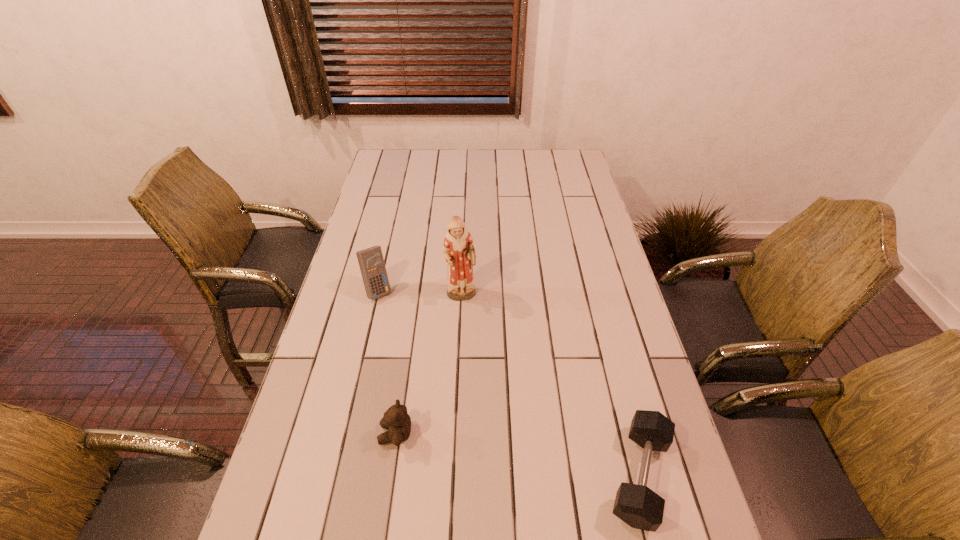
You are a GUI agent. You are given a task and a screenshot of the screen. Output one action in this format:
    pyautogui.click(x=<x>, y=<y>)
    Task: Click on the free spot that satisfies the following two spatial constraints: 1. on the front side of the calculator; 2. on the face of the second shortest object
    The image size is (960, 540).
    Given the screenshot: What is the action you would take?
    pyautogui.click(x=345, y=434)

The image size is (960, 540). I want to click on free space that satisfies the following two spatial constraints: 1. on the front side of the calculator; 2. on the face of the teddy bear, so click(x=345, y=434).

Locate an element on the screen. free space that satisfies the following two spatial constraints: 1. on the front side of the calculator; 2. on the face of the second shortest object is located at coordinates [x=345, y=434].

I want to click on vacant space that satisfies the following two spatial constraints: 1. on the front side of the dumbbell; 2. on the right side of the leftmost object, so click(335, 476).